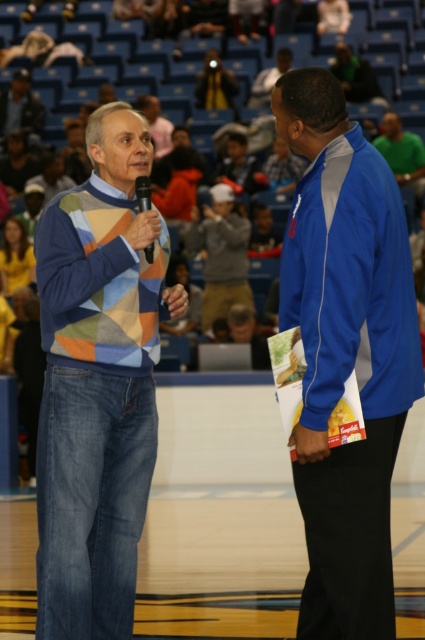
Does blue fabric jacket at center have a greater height compared to patchwork sweater at left?

Incorrect, blue fabric jacket at center's height is not larger of patchwork sweater at left's.

Describe the element at coordinates (345, 353) in the screenshot. I see `blue fabric jacket at center` at that location.

Is point (359, 221) farther from camera compared to point (113, 486)?

That is False.

Locate an element on the screen. blue fabric jacket at center is located at coordinates (345, 353).

Who is lower down, blue fabric jacket at center or green jersey at upper right?

blue fabric jacket at center is below.

Does point (367, 420) lie in front of point (388, 131)?

Yes, point (367, 420) is in front of point (388, 131).

You are a GUI agent. You are given a task and a screenshot of the screen. Output one action in this format:
    pyautogui.click(x=<x>, y=<y>)
    Task: Click on the blue fabric jacket at center
    
    Given the screenshot: What is the action you would take?
    pyautogui.click(x=345, y=353)

At what (x,y) coordinates should I click in order to perform the action: click on blue fabric jacket at center. Please return your answer as a coordinate pair (x, y). This screenshot has width=425, height=640. Looking at the image, I should click on (345, 353).

Can you confirm if blue fabric jacket at center is positioned below black plastic microphone at center?

Yes.

Is point (384, 173) closer to viewer compared to point (147, 256)?

Yes, it is.

Who is more distant from viewer, (394, 314) or (136, 184)?

The point (136, 184) is more distant.

Identify the location of blue fabric jacket at center. (345, 353).